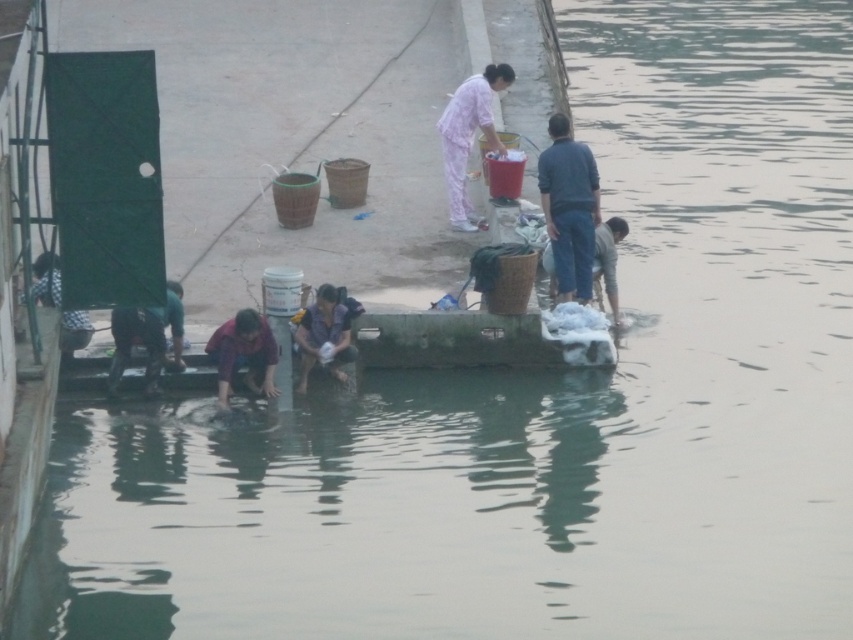
You are a traveler who just arrived at the riverside. You see the pink fabric at center and the purple fabric at lower center. Which fabric is placed higher up on the platform?

The pink fabric at center is positioned over the purple fabric at lower center, so it is placed higher up on the platform.

In the scene shown: You are a laundry worker who needs to determine which clothing item takes up more space when laid flat. Based on the scene, which one between the blue denim jeans at center and the light brown fabric pants at lower right is wider?

The blue denim jeans at center is wider than the light brown fabric pants at lower right, so it takes up more space when laid flat.